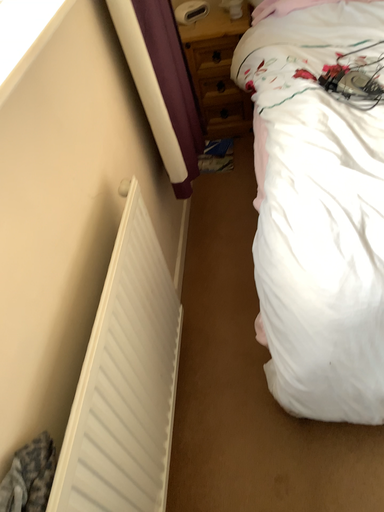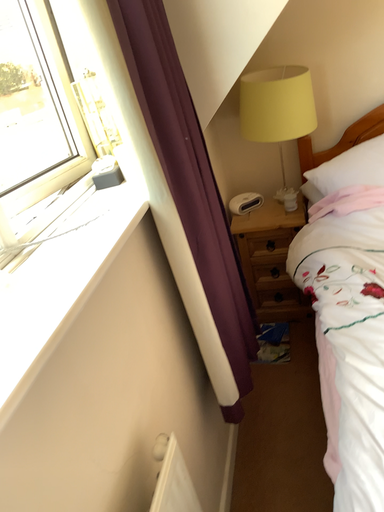
Question: How did the camera likely rotate when shooting the video?

Choices:
 (A) rotated upward
 (B) rotated downward

Answer: (A)